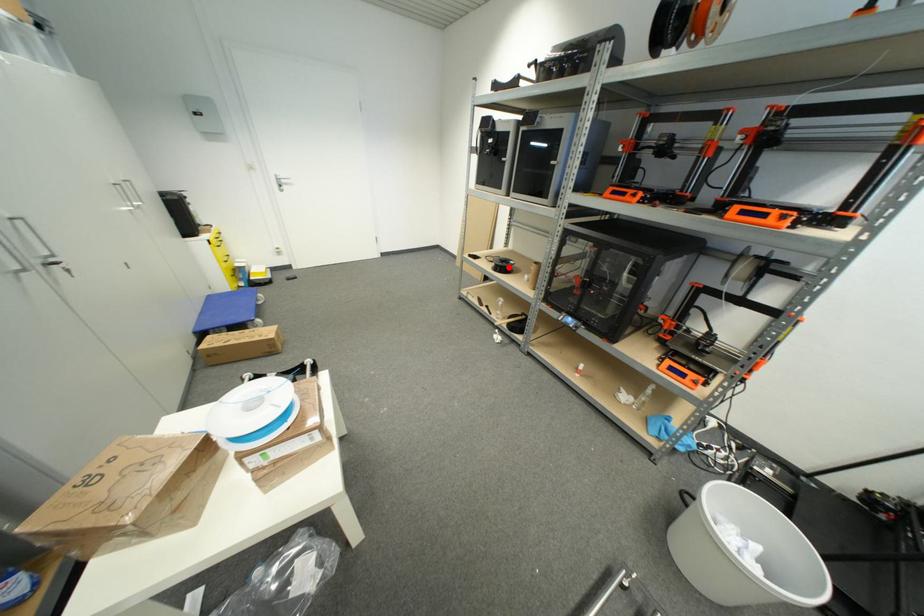
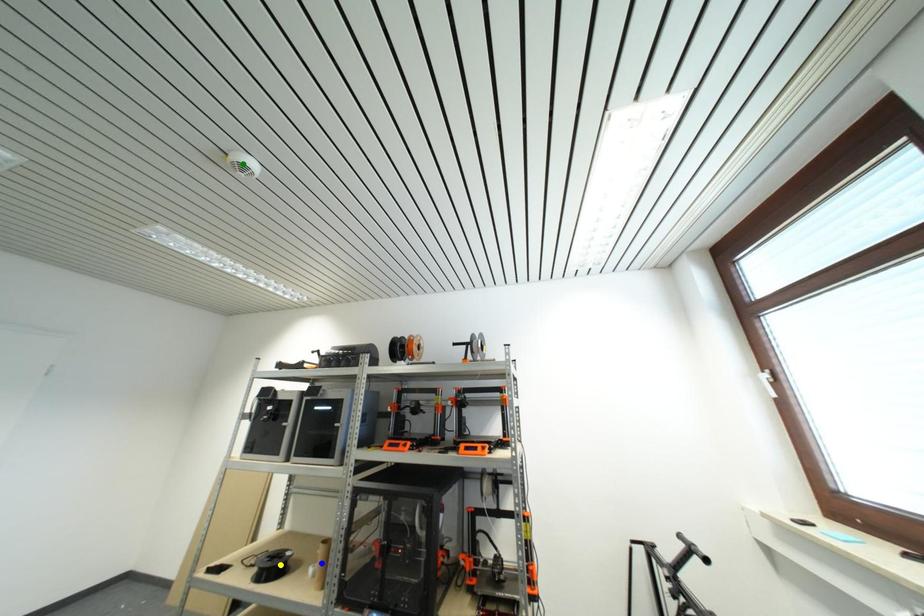
Question: I am providing you with two images of the same scene from different viewpoints. A red point is marked on the first image. You are given multiple points on the second image. Which spot in image 2 lines up with the point in image 1?

Choices:
 (A) green point
 (B) yellow point
 (C) blue point

Answer: (B)